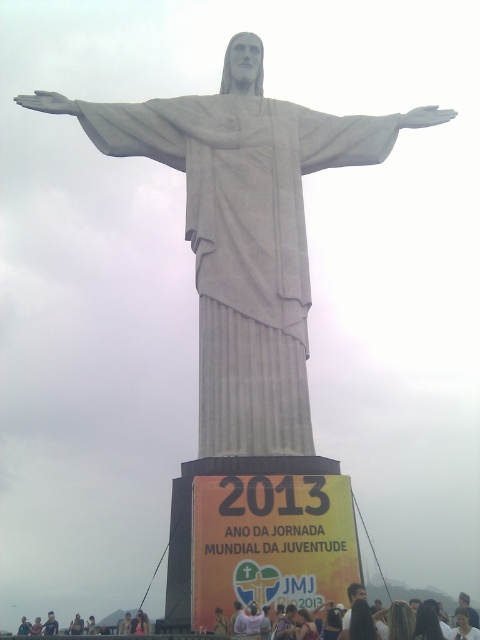
Based on the scene description, what is the 2D coordinate of the white marble statue at center?

The 2D coordinate of the white marble statue at center is at point (244, 232).

You are standing at the base of the Christ the Redeemer statue and want to take a photo. There are two points marked on the statue for reference. Which point, point (196, 132) or point (50, 630), is closer to your position?

Point (196, 132) is closer to the camera than point (50, 630), so it is closer to your position.